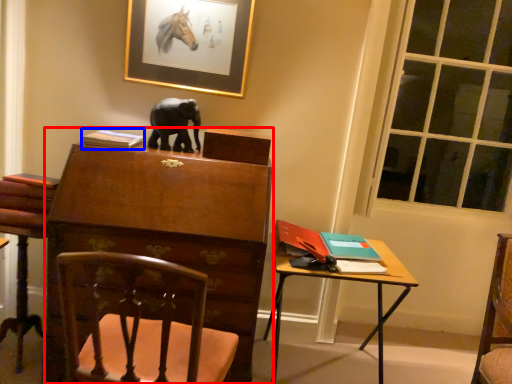
Question: Which object appears farthest to the camera in this image, chest of drawers (highlighted by a red box) or book (highlighted by a blue box)?

Choices:
 (A) chest of drawers
 (B) book

Answer: (B)